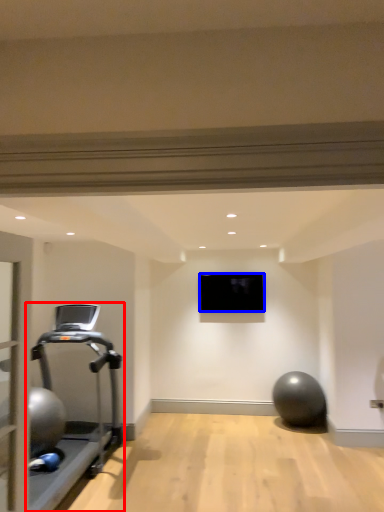
Question: Among these objects, which one is farthest to the camera, treadmill (highlighted by a red box) or projection screen (highlighted by a blue box)?

Choices:
 (A) treadmill
 (B) projection screen

Answer: (B)